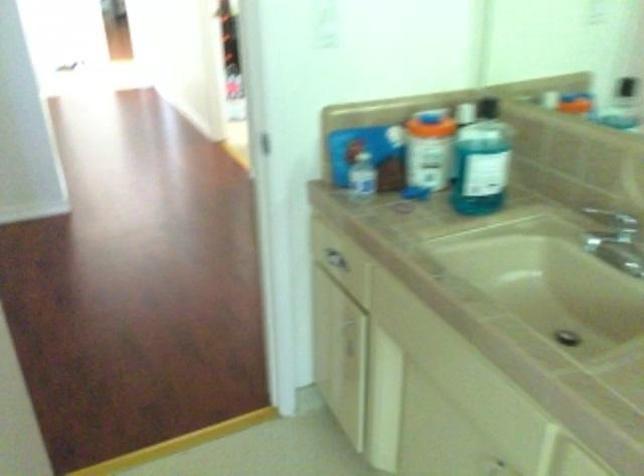
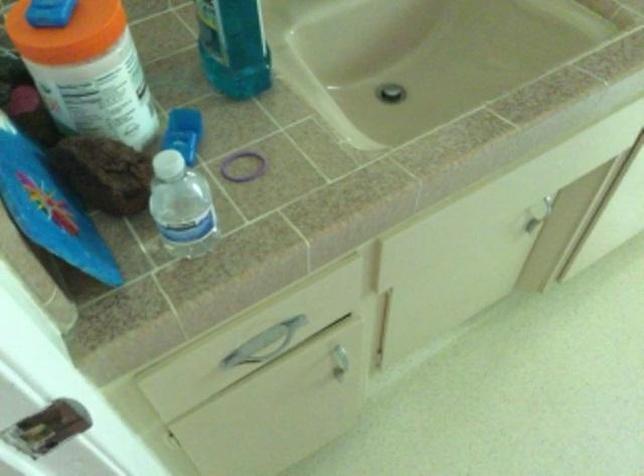
Find the pixel in the second image that matches (380,375) in the first image.

(339, 357)